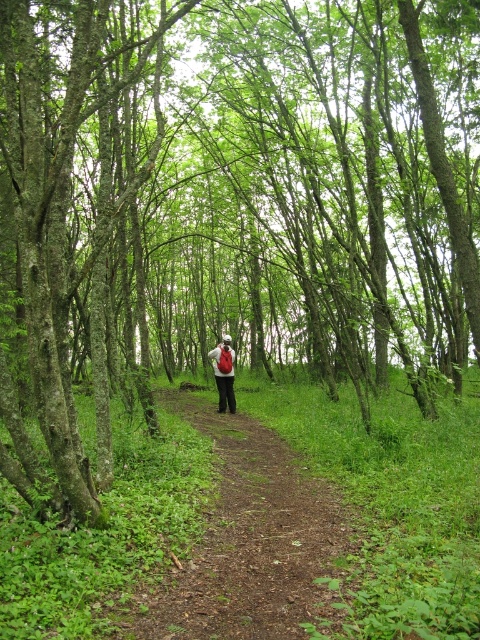
Question: Which point is closer to the camera taking this photo?

Choices:
 (A) (239, 621)
 (B) (215, 362)

Answer: (A)

Question: Is brown dirt path at center to the left of matte red backpack at center from the viewer's perspective?

Choices:
 (A) yes
 (B) no

Answer: (B)

Question: Which of the following is the closest to the observer?

Choices:
 (A) matte red backpack at center
 (B) brown dirt path at center

Answer: (B)

Question: Does brown dirt path at center appear under matte red backpack at center?

Choices:
 (A) no
 (B) yes

Answer: (B)

Question: Where is brown dirt path at center located in relation to matte red backpack at center in the image?

Choices:
 (A) right
 (B) left

Answer: (A)